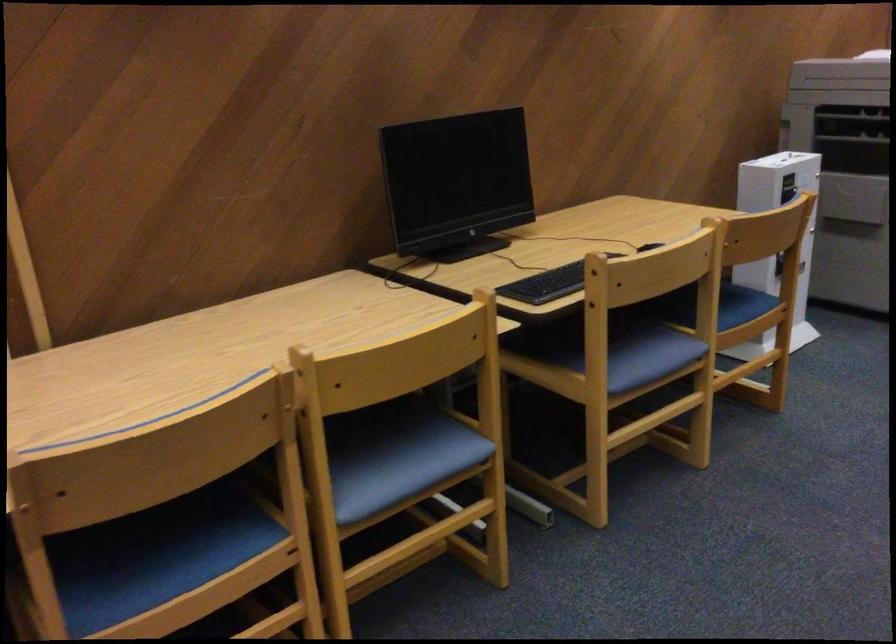
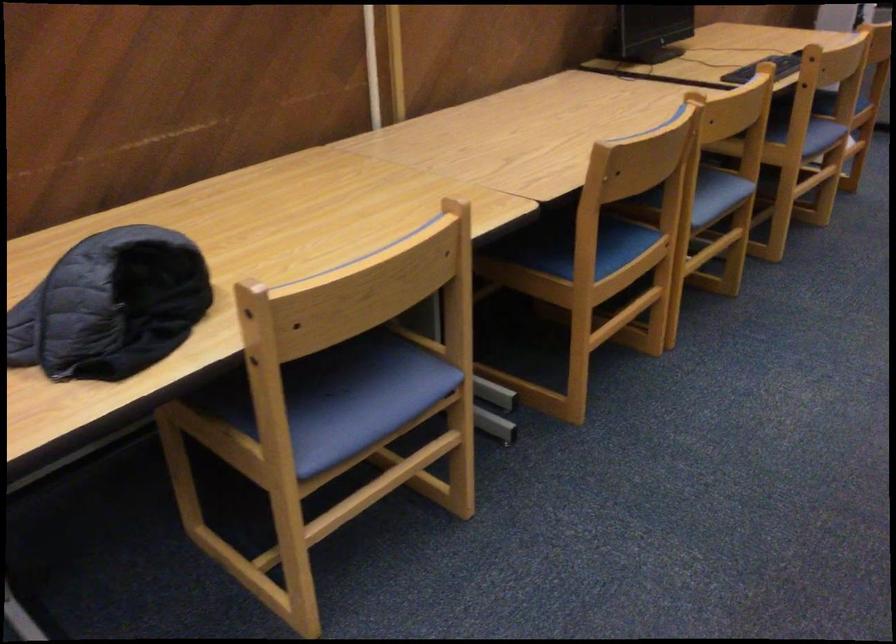
Locate, in the second image, the point that corresponds to point (417, 471) in the first image.

(718, 194)